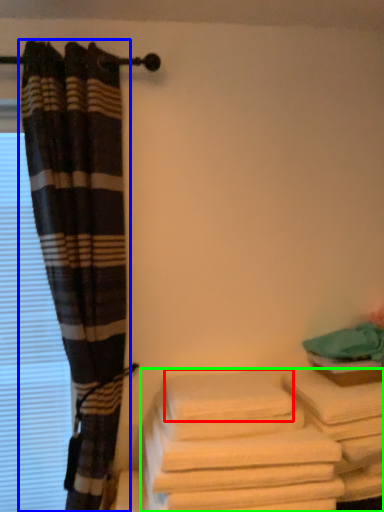
Question: Considering the real-world distances, which object is farthest from bath towel (highlighted by a red box)? curtain (highlighted by a blue box) or towel (highlighted by a green box)?

Choices:
 (A) curtain
 (B) towel

Answer: (A)